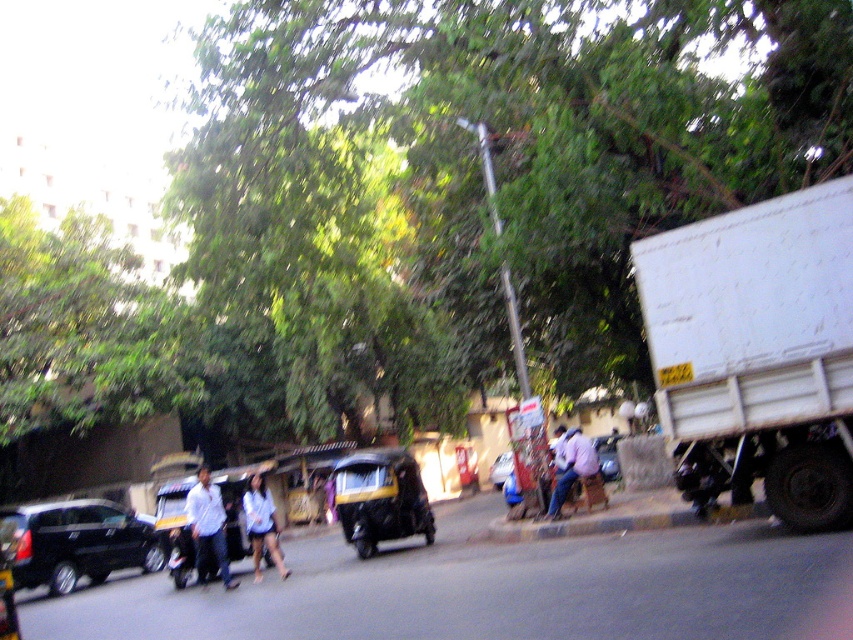
The image size is (853, 640). Describe the element at coordinates (474, 184) in the screenshot. I see `green leafy tree at upper center` at that location.

Does point (282, 358) come behind point (45, 531)?

Yes, it is.

Is point (283, 266) behind point (65, 572)?

Yes, it is.

Locate an element on the screen. This screenshot has height=640, width=853. green leafy tree at upper center is located at coordinates (474, 184).

Which of these two, shiny black car at left or matte black car at center, stands shorter?

shiny black car at left is shorter.

Does shiny black car at left appear over matte black car at center?

Yes, shiny black car at left is above matte black car at center.

Identify the location of shiny black car at left. (74, 541).

Is white shirt at center closer to the viewer compared to matte black car at center?

Yes, it is.

Can you confirm if white shirt at center is positioned to the left of matte black car at center?

Yes, white shirt at center is to the left of matte black car at center.

Between point (196, 561) and point (618, 465), which one is positioned in front?

Point (196, 561)

Image resolution: width=853 pixels, height=640 pixels. I want to click on white shirt at center, so click(x=207, y=528).